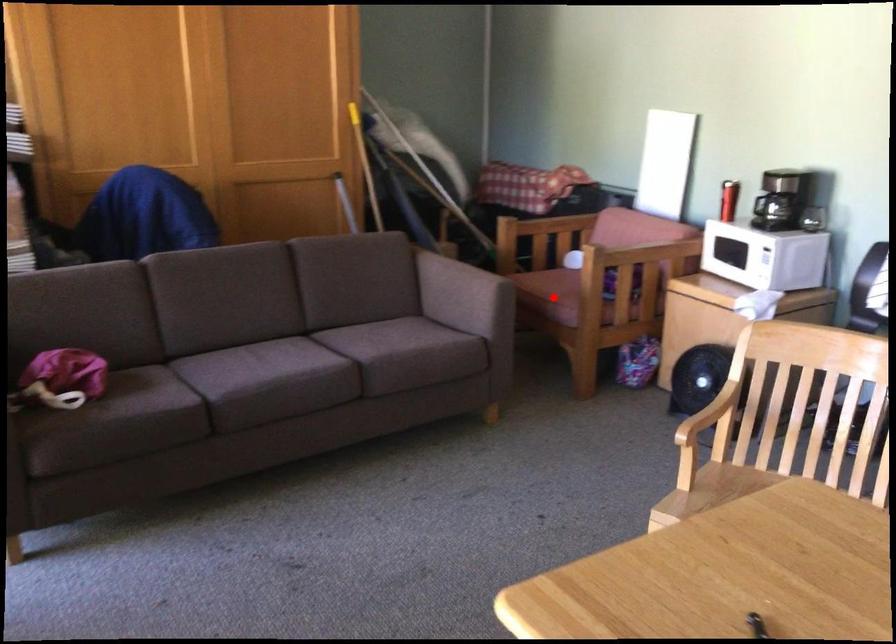
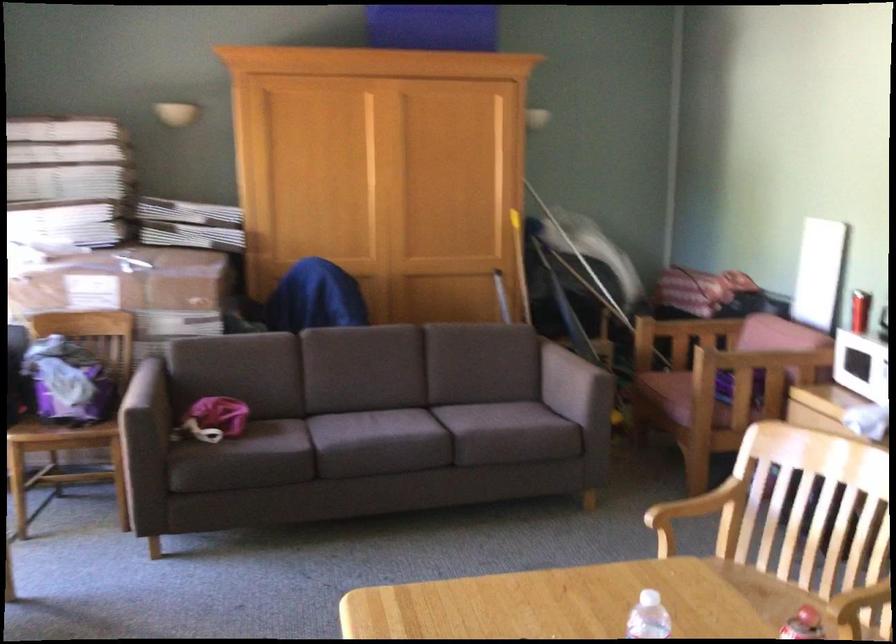
Locate, in the second image, the point that corresponds to the highlighted location in the first image.

(669, 393)